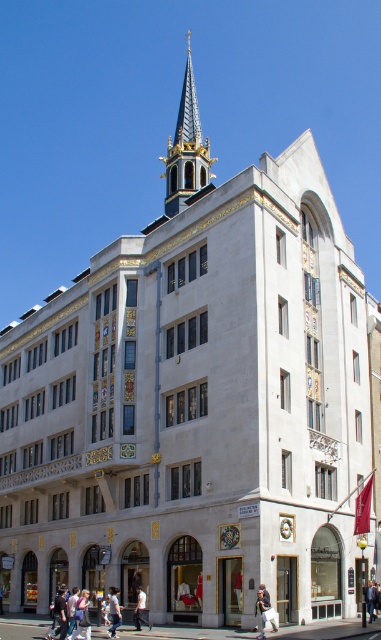
Who is lower down, light blue jeans at lower center or light brown leather jacket at lower center?

light brown leather jacket at lower center is below.

Can you confirm if light blue jeans at lower center is wider than light brown leather jacket at lower center?

In fact, light blue jeans at lower center might be narrower than light brown leather jacket at lower center.

This screenshot has width=381, height=640. Identify the location of light blue jeans at lower center. (113, 611).

Image resolution: width=381 pixels, height=640 pixels. What do you see at coordinates (81, 616) in the screenshot?
I see `light brown leather jacket at lower left` at bounding box center [81, 616].

Between light brown leather jacket at lower left and light brown leather jacket at lower center, which one appears on the left side from the viewer's perspective?

Positioned to the left is light brown leather jacket at lower center.

Describe the element at coordinates (81, 616) in the screenshot. The height and width of the screenshot is (640, 381). I see `light brown leather jacket at lower left` at that location.

The height and width of the screenshot is (640, 381). What are the coordinates of `light brown leather jacket at lower left` in the screenshot? It's located at click(81, 616).

From the picture: Is white cotton pants at lower right above light blue jeans at lower center?

Correct, white cotton pants at lower right is located above light blue jeans at lower center.

Between white cotton pants at lower right and light blue jeans at lower center, which one appears on the left side from the viewer's perspective?

Positioned to the left is light blue jeans at lower center.

This screenshot has width=381, height=640. What do you see at coordinates (265, 612) in the screenshot?
I see `white cotton pants at lower right` at bounding box center [265, 612].

Where is `white cotton pants at lower right`? white cotton pants at lower right is located at coordinates (265, 612).